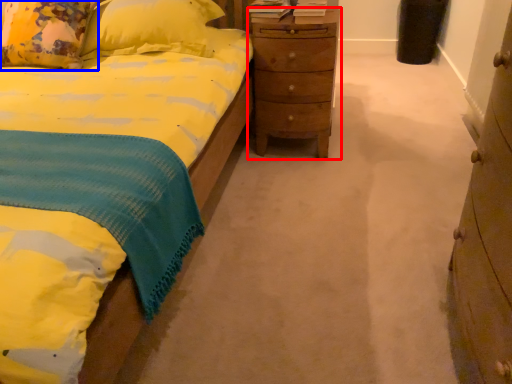
Question: Which object is further to the camera taking this photo, nightstand (highlighted by a red box) or pillow (highlighted by a blue box)?

Choices:
 (A) nightstand
 (B) pillow

Answer: (A)